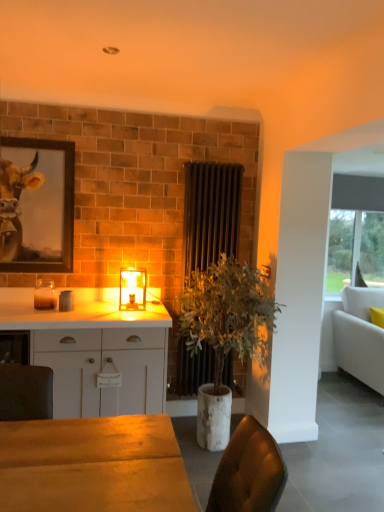
Question: Can you see translucent glass lamp at center touching wooden framed painting at upper left?

Choices:
 (A) yes
 (B) no

Answer: (B)

Question: Is translucent glass lamp at center taller than wooden framed painting at upper left?

Choices:
 (A) yes
 (B) no

Answer: (B)

Question: Can you confirm if translucent glass lamp at center is shorter than wooden framed painting at upper left?

Choices:
 (A) yes
 (B) no

Answer: (A)

Question: Does translucent glass lamp at center lie behind wooden framed painting at upper left?

Choices:
 (A) no
 (B) yes

Answer: (A)

Question: From the image's perspective, is translucent glass lamp at center on wooden framed painting at upper left?

Choices:
 (A) yes
 (B) no

Answer: (B)

Question: Considering their positions, is white matte cabinet at center located in front of or behind black metal radiator at center?

Choices:
 (A) behind
 (B) front

Answer: (B)

Question: Considering the positions of point (72, 345) and point (205, 263), is point (72, 345) closer or farther from the camera than point (205, 263)?

Choices:
 (A) farther
 (B) closer

Answer: (B)

Question: Is white matte cabinet at center inside or outside of black metal radiator at center?

Choices:
 (A) outside
 (B) inside

Answer: (A)

Question: From the image's perspective, is white matte cabinet at center above or below black metal radiator at center?

Choices:
 (A) above
 (B) below

Answer: (B)

Question: Is wooden framed painting at upper left inside or outside of black metal radiator at center?

Choices:
 (A) outside
 (B) inside

Answer: (A)

Question: Does point (13, 216) appear closer or farther from the camera than point (182, 355)?

Choices:
 (A) closer
 (B) farther

Answer: (A)

Question: Is wooden framed painting at upper left in front of or behind black metal radiator at center in the image?

Choices:
 (A) behind
 (B) front

Answer: (B)

Question: From the image's perspective, is wooden framed painting at upper left located above or below black metal radiator at center?

Choices:
 (A) above
 (B) below

Answer: (A)

Question: In the image, is translucent glass candle at left positioned in front of or behind black metal radiator at center?

Choices:
 (A) front
 (B) behind

Answer: (A)

Question: Based on their sizes in the image, would you say translucent glass candle at left is bigger or smaller than black metal radiator at center?

Choices:
 (A) small
 (B) big

Answer: (A)